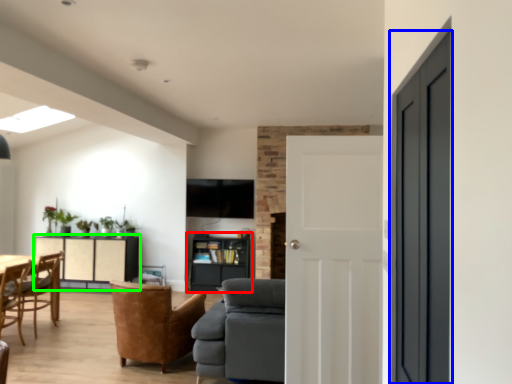
Question: Based on their relative distances, which object is farther from shelf (highlighted by a red box)? Choose from door (highlighted by a blue box) and cabinetry (highlighted by a green box).

Choices:
 (A) door
 (B) cabinetry

Answer: (A)